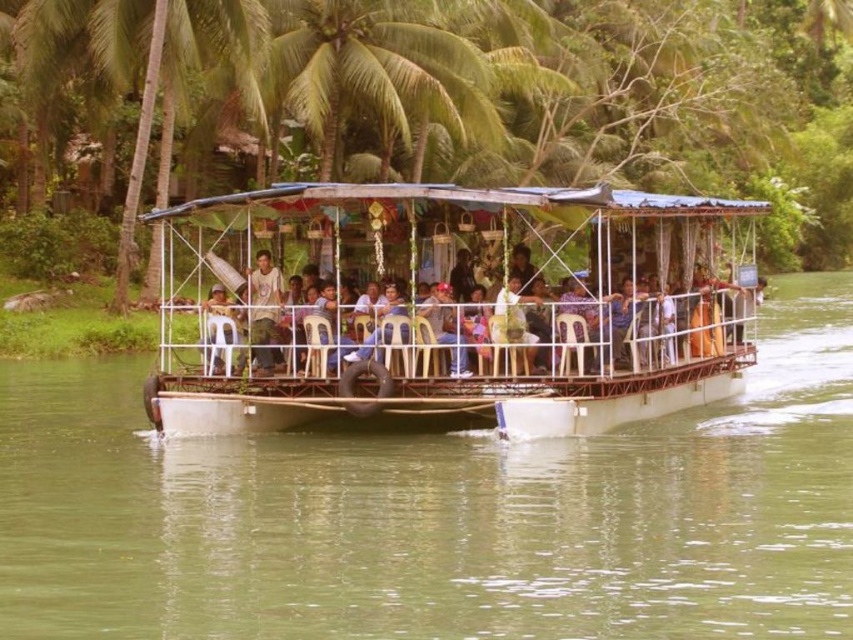
Where is the white plastic boat at center located in the image?

The white plastic boat at center is located at point (x=453, y=308) in the image.

In the scene shown: You are navigating a riverboat tour and need to position a new passenger boarding ramp. The green plastic boat at center is currently at coordinates point 0.803, 0.516. Where should the ramp be placed relative to the boat to ensure safe boarding?

The ramp should be placed at the rear of the green plastic boat at center to ensure safe boarding, as this location is typically used for embarkation and disembarkation in such vessels.